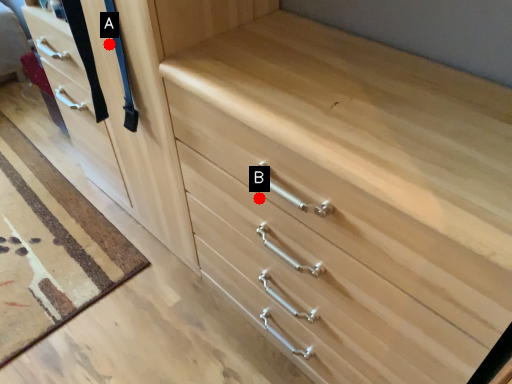
Question: Two points are circled on the image, labeled by A and B beside each circle. Which point is farther from the camera taking this photo?

Choices:
 (A) A is further
 (B) B is further

Answer: (A)